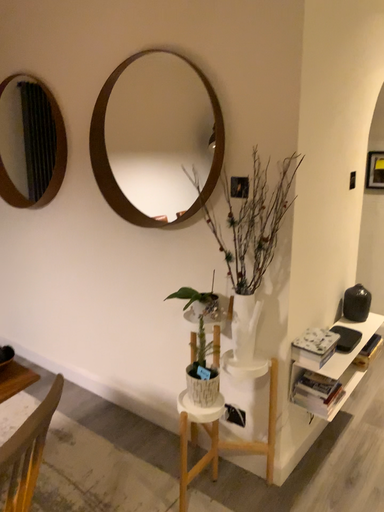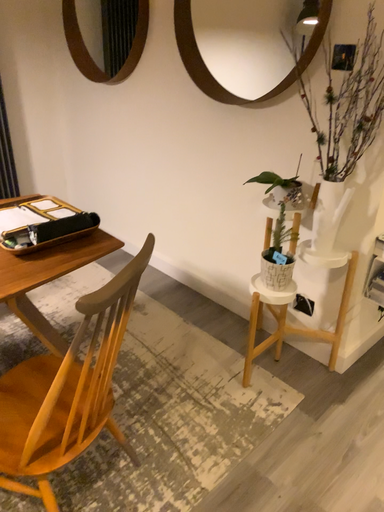
Question: How did the camera likely rotate when shooting the video?

Choices:
 (A) rotated right
 (B) rotated left

Answer: (B)